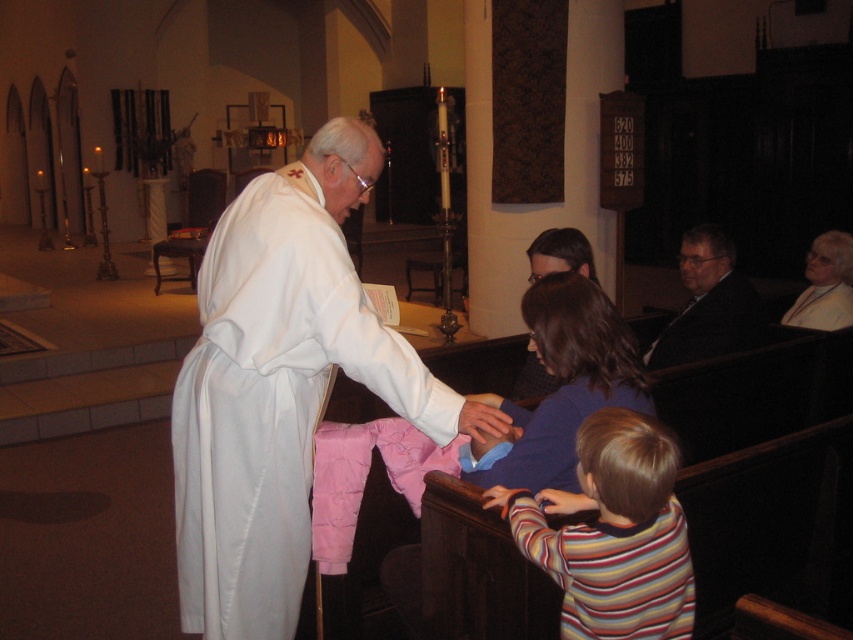
Question: Among these points, which one is farthest from the camera?

Choices:
 (A) (643, 540)
 (B) (352, 333)
 (C) (848, 291)

Answer: (C)

Question: Which object is farther from the camera taking this photo?

Choices:
 (A) striped cotton shirt at lower right
 (B) white clothed figure at center
 (C) matte white robe at center

Answer: (C)

Question: Is striped cotton shirt at lower right smaller than matte white robe at center?

Choices:
 (A) no
 (B) yes

Answer: (B)

Question: Is striped cotton shirt at lower right thinner than matte white robe at center?

Choices:
 (A) yes
 (B) no

Answer: (A)

Question: In this image, where is striped cotton shirt at lower right located relative to white matte robe at upper right?

Choices:
 (A) above
 (B) below

Answer: (B)

Question: Which point appears closest to the camera in this image?

Choices:
 (A) (751, 332)
 (B) (660, 576)
 (C) (849, 308)
 (D) (323, 570)

Answer: (B)